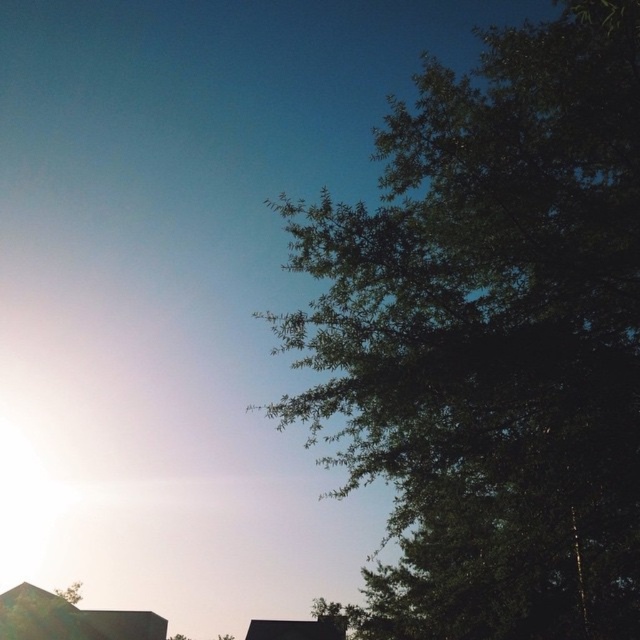
Which is below, green leafy tree at right or green leafy tree at lower left?

green leafy tree at lower left is lower down.

Which is behind, point (440, 628) or point (68, 584)?

Point (68, 584)

Find the location of a particular element. This screenshot has height=640, width=640. green leafy tree at right is located at coordinates (490, 337).